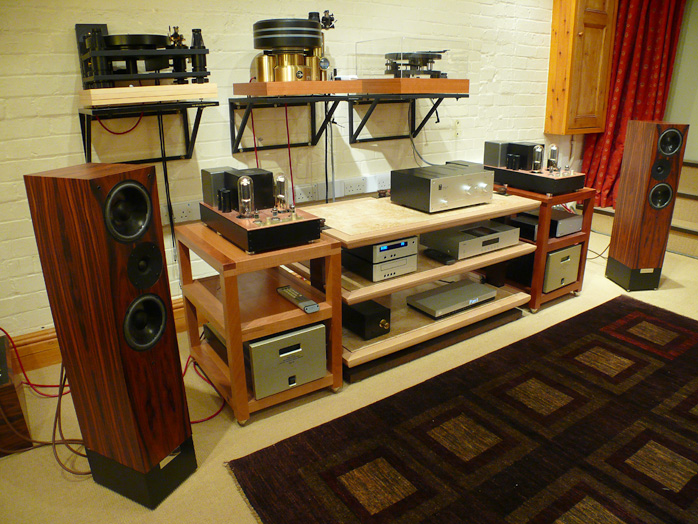
Image resolution: width=698 pixels, height=524 pixels. I want to click on right speaker, so coord(627,250).